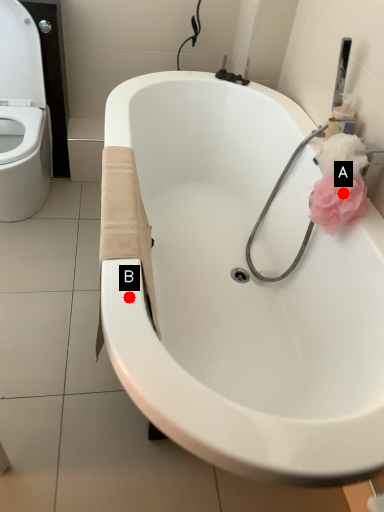
Question: Two points are circled on the image, labeled by A and B beside each circle. Which point is farther to the camera?

Choices:
 (A) A is further
 (B) B is further

Answer: (A)